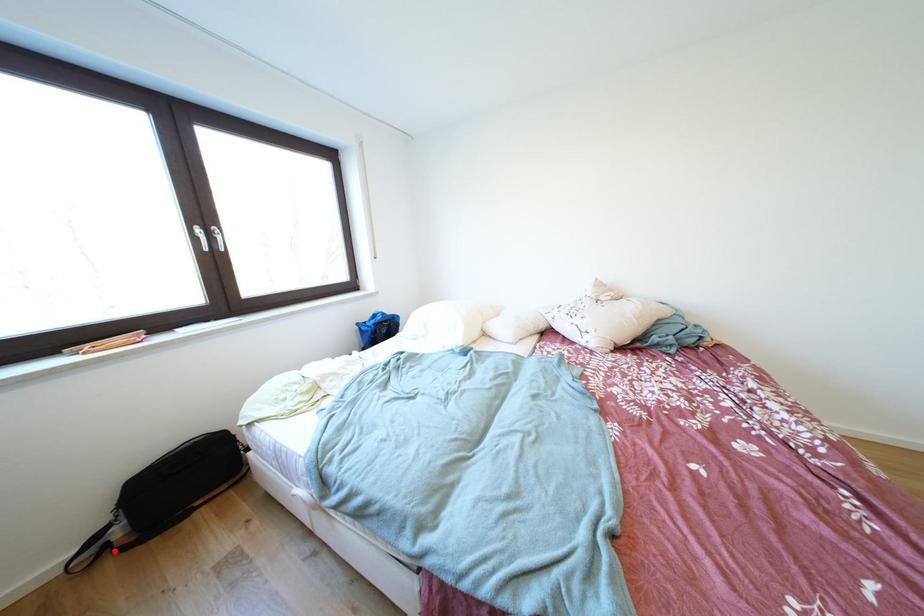
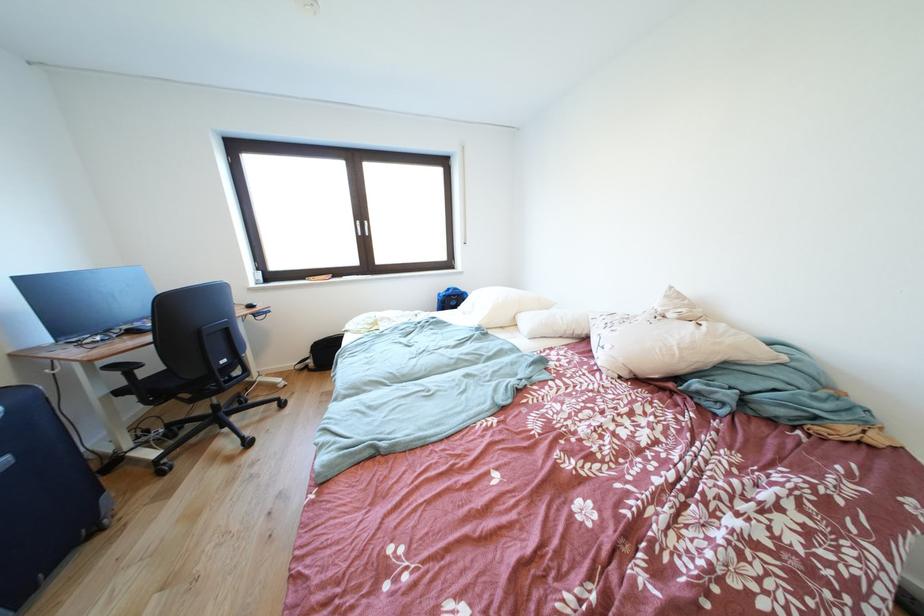
Where in the second image is the point corresponding to the highlighted location from the first image?

(315, 371)